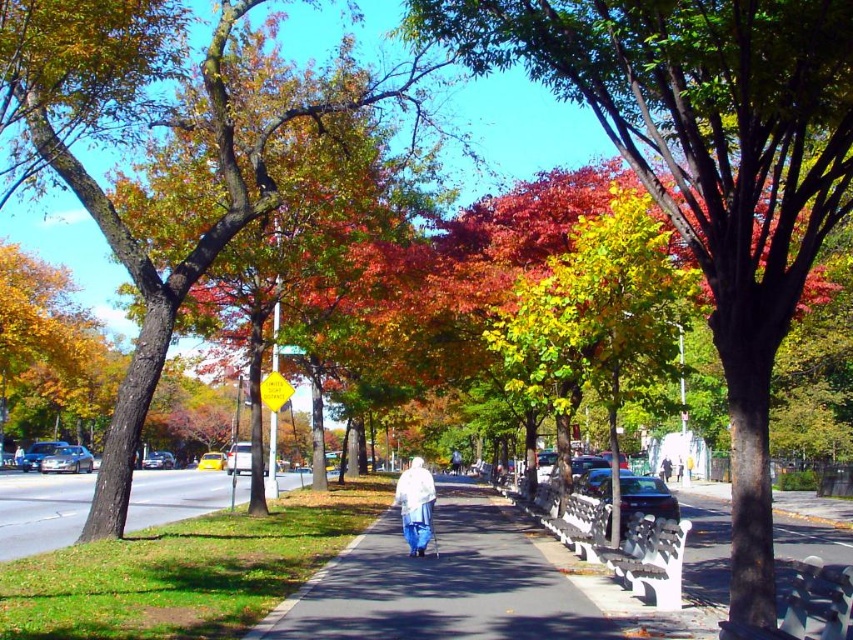
You are a delivery person with a cart that is 3 feet wide. You need to navigate through the pathway between the green leafy tree at center and the white fabric coat at center. Can your cart fit through the space between them?

The distance between the green leafy tree at center and the white fabric coat at center is 24.58 feet. Since your cart is only 3 feet wide, it can easily fit through the space between them as the distance is much wider than the cart.

You are a gardener planning to plant a new tree in the autumn scene. The green leafy tree at center and the gray asphalt at lower left are both in your view. Which area is more suitable for planting a new tree?

The green leafy tree at center is smaller than the gray asphalt at lower left, so the gray asphalt at lower left is more suitable for planting a new tree because it has more space available.